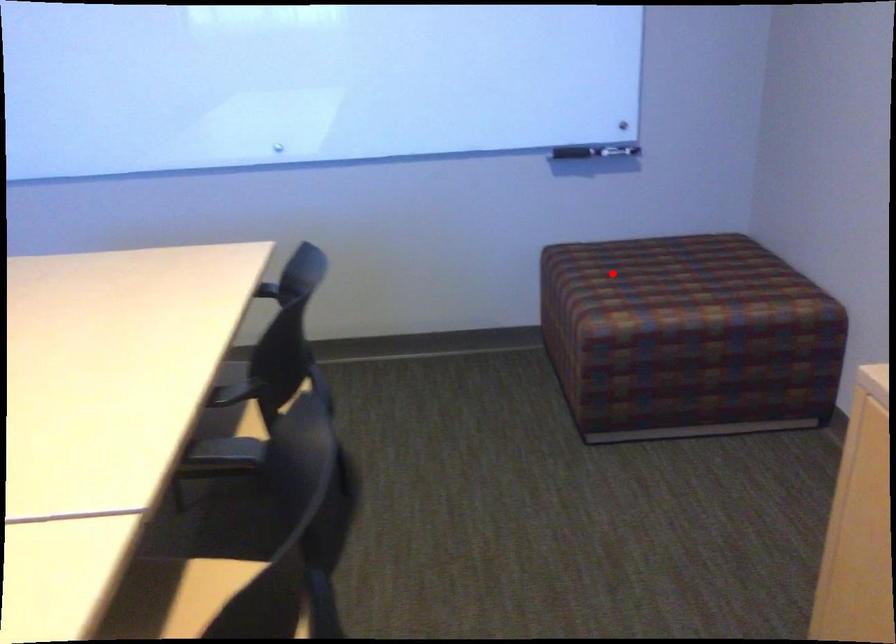
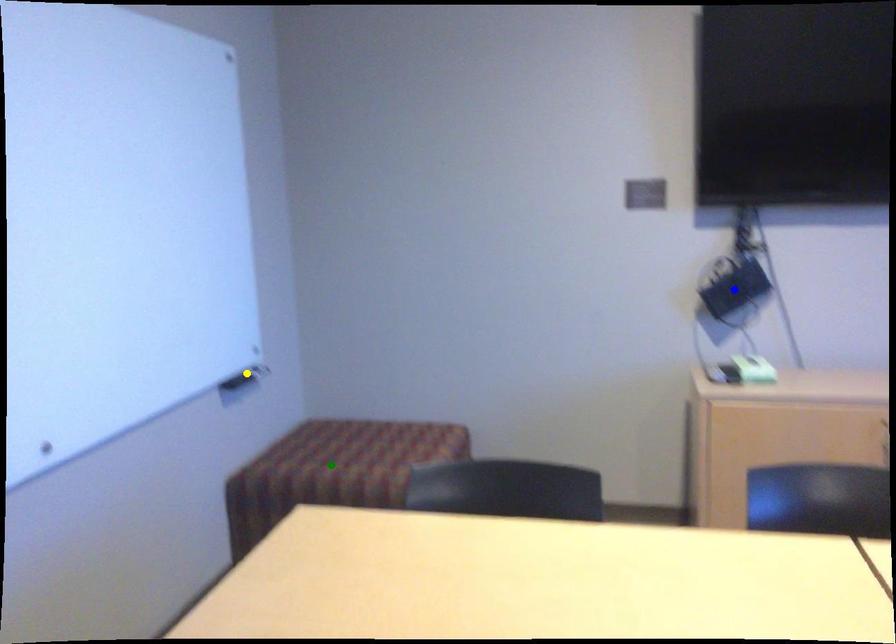
Question: I am providing you with two images of the same scene from different viewpoints. A red point is marked on the first image. You are given multiple points on the second image. Which point in image 2 represents the same 3d spot as the red point in image 1?

Choices:
 (A) blue point
 (B) green point
 (C) yellow point

Answer: (B)